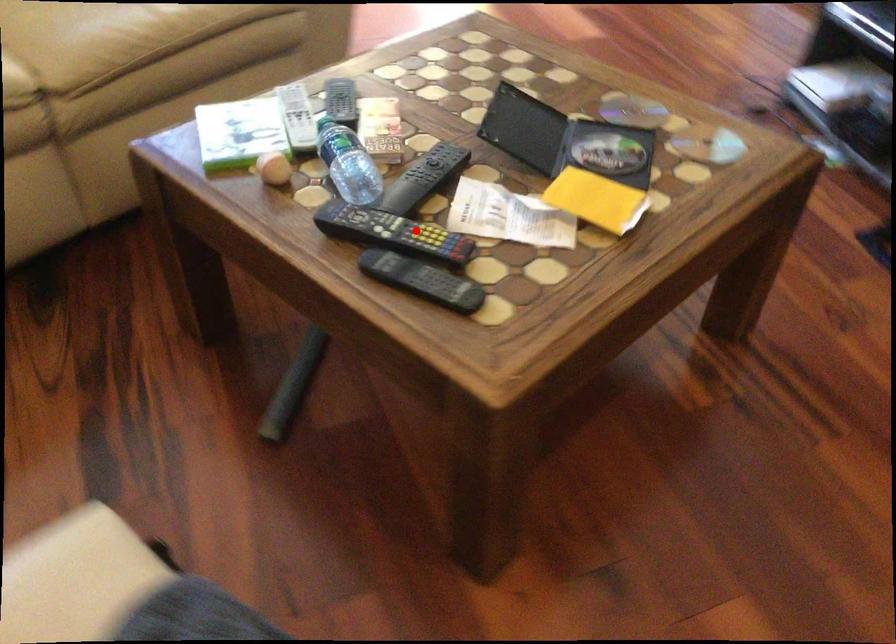
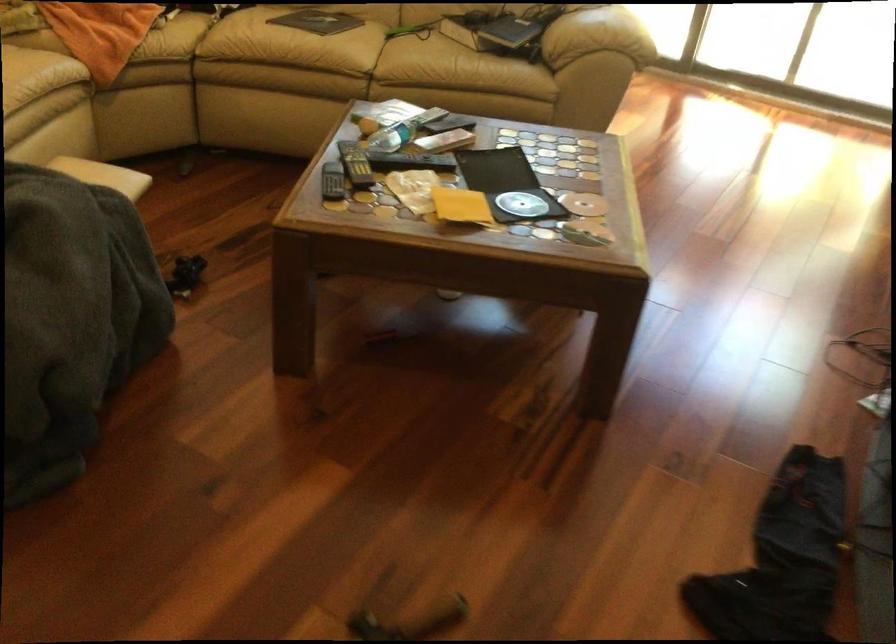
Locate, in the second image, the point that corresponds to the highlighted location in the first image.

(355, 164)